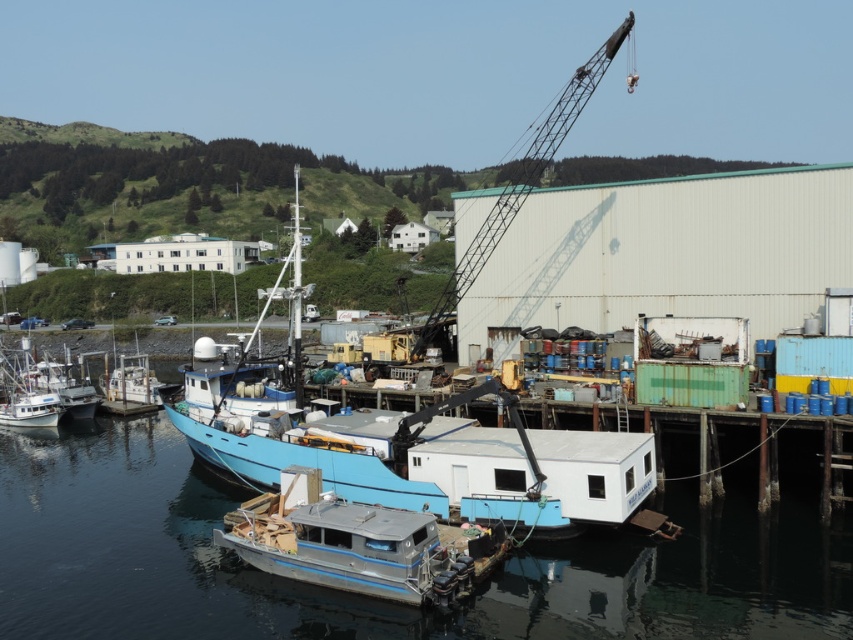
Question: Which object is positioned closest to the metallic gray crane at center?

Choices:
 (A) white matte boat at left
 (B) blue matte boat at center

Answer: (B)

Question: Which of the following is the closest to the observer?

Choices:
 (A) blue matte boat at center
 (B) metallic gray pontoon boat at center
 (C) white matte boat at left

Answer: (B)

Question: Which of the following is the farthest from the observer?

Choices:
 (A) (376, 461)
 (B) (65, 406)

Answer: (B)

Question: Is blue matte boat at center smaller than metallic gray crane at center?

Choices:
 (A) no
 (B) yes

Answer: (B)

Question: Does metallic gray pontoon boat at center come behind white matte boat at left?

Choices:
 (A) yes
 (B) no

Answer: (B)

Question: Is transparent blue water at lower center smaller than metallic gray crane at center?

Choices:
 (A) no
 (B) yes

Answer: (B)